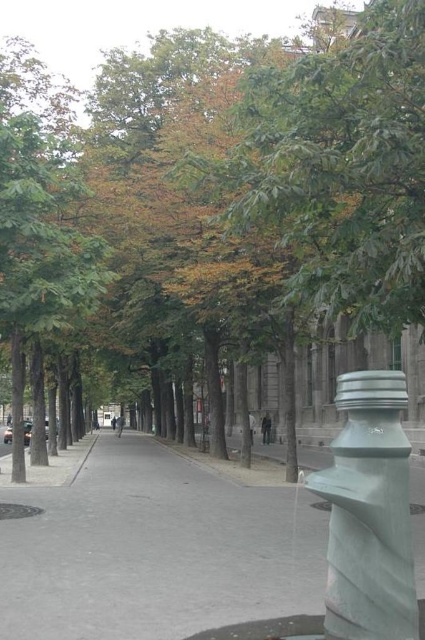
Question: Can you confirm if green leafy tree at left is positioned to the right of satin gray hydrant at center right?

Choices:
 (A) yes
 (B) no

Answer: (B)

Question: Does green leafy tree at left have a larger size compared to satin gray hydrant at center right?

Choices:
 (A) no
 (B) yes

Answer: (B)

Question: Among these points, which one is farthest from the camera?

Choices:
 (A) (391, 602)
 (B) (6, 284)

Answer: (B)

Question: Based on their relative distances, which object is nearer to the green leafy tree at left?

Choices:
 (A) satin gray hydrant at center right
 (B) gray concrete pavement at center

Answer: (B)

Question: Can you confirm if gray concrete pavement at center is positioned to the right of satin gray hydrant at center right?

Choices:
 (A) no
 (B) yes

Answer: (A)

Question: Which point is farther to the camera?

Choices:
 (A) (70, 550)
 (B) (387, 532)
 (C) (62, 177)

Answer: (C)